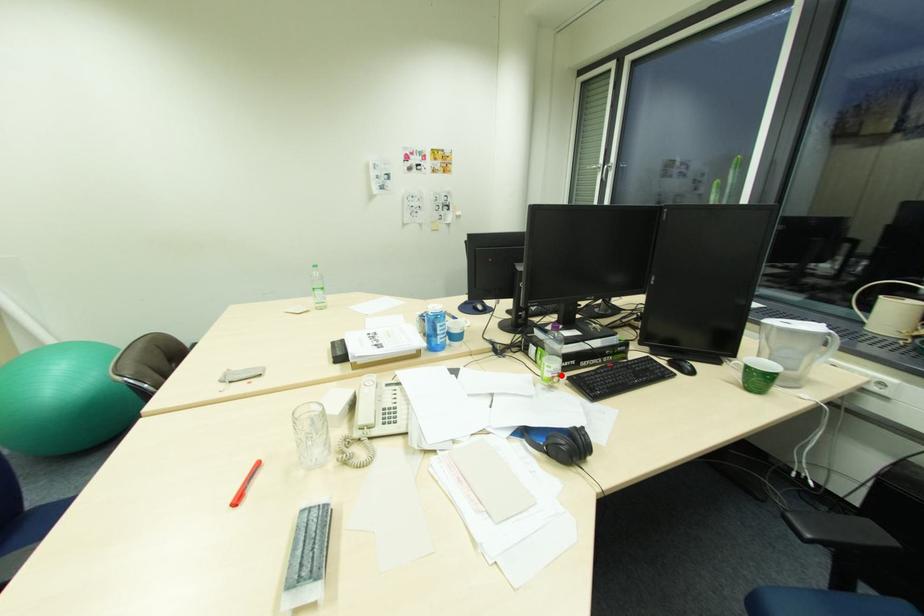
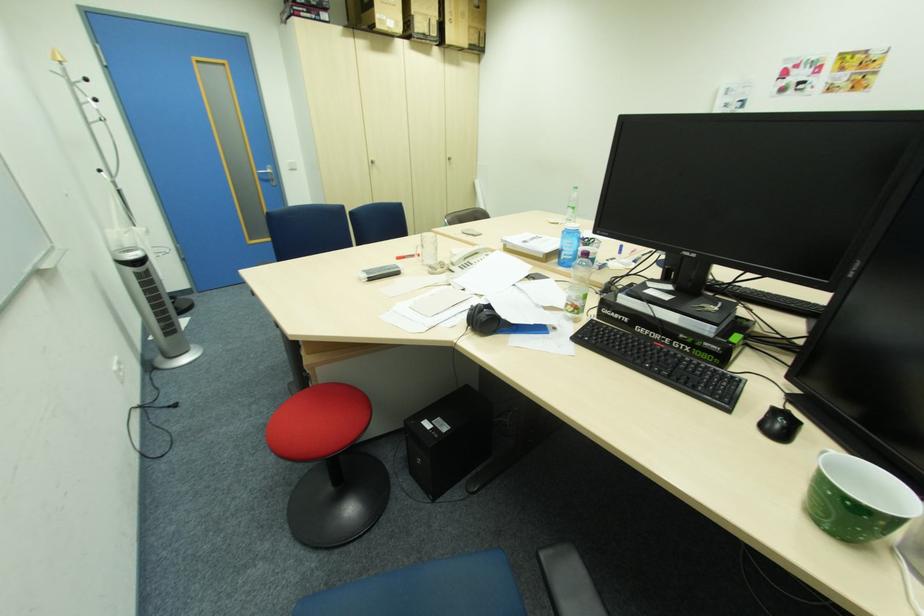
Where in the second image is the point corresponding to the highlighted location from the first image?

(575, 304)